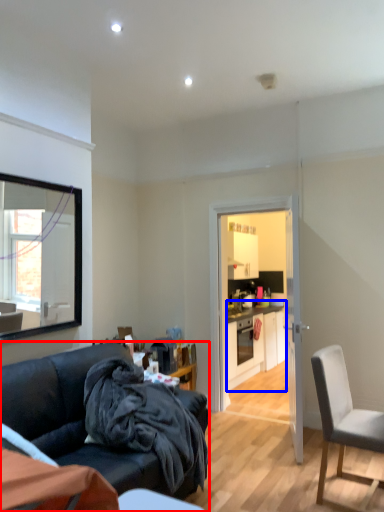
Question: Which of the following is the farthest to the observer, studio couch (highlighted by a red box) or cabinetry (highlighted by a blue box)?

Choices:
 (A) studio couch
 (B) cabinetry

Answer: (B)